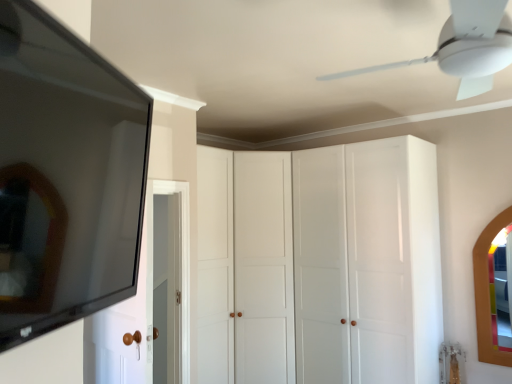
Question: Considering the relative sizes of white glossy cabinet at center and wooden-framed mirror at right, which appears as the second mirror when viewed from the top, in the image provided, is white glossy cabinet at center bigger than wooden-framed mirror at right, which appears as the second mirror when viewed from the top,?

Choices:
 (A) yes
 (B) no

Answer: (A)

Question: Could wooden-framed mirror at right, positioned as the 2th mirror in left-to-right order, be considered to be inside white glossy cabinet at center?

Choices:
 (A) yes
 (B) no

Answer: (B)

Question: Considering the relative sizes of white glossy cabinet at center and wooden-framed mirror at right, positioned as the 2th mirror in left-to-right order, in the image provided, is white glossy cabinet at center thinner than wooden-framed mirror at right, positioned as the 2th mirror in left-to-right order,?

Choices:
 (A) yes
 (B) no

Answer: (B)

Question: Can you confirm if white glossy cabinet at center is shorter than wooden-framed mirror at right, which is the first mirror in bottom-to-top order?

Choices:
 (A) no
 (B) yes

Answer: (A)

Question: From the image's perspective, is white glossy cabinet at center located beneath wooden-framed mirror at right, positioned as the 2th mirror in left-to-right order?

Choices:
 (A) no
 (B) yes

Answer: (B)

Question: Could you tell me if white glossy cabinet at center is facing wooden-framed mirror at right, positioned as the 2th mirror in left-to-right order?

Choices:
 (A) yes
 (B) no

Answer: (B)

Question: Considering the relative positions of matte black mirror at left, arranged as the second mirror when viewed from the back, and white wood door at left in the image provided, is matte black mirror at left, arranged as the second mirror when viewed from the back, in front of white wood door at left?

Choices:
 (A) no
 (B) yes

Answer: (B)

Question: Is matte black mirror at left, acting as the first mirror starting from the left, positioned with its back to white wood door at left?

Choices:
 (A) yes
 (B) no

Answer: (B)

Question: Is matte black mirror at left, acting as the first mirror starting from the left, facing towards white wood door at left?

Choices:
 (A) no
 (B) yes

Answer: (A)

Question: Is matte black mirror at left, which ranks as the first mirror in top-to-bottom order, beside white wood door at left?

Choices:
 (A) yes
 (B) no

Answer: (B)

Question: From the image's perspective, is matte black mirror at left, the 2th mirror positioned from the bottom, on top of white wood door at left?

Choices:
 (A) yes
 (B) no

Answer: (A)

Question: Does matte black mirror at left, the 2th mirror positioned from the bottom, appear on the left side of white wood door at left?

Choices:
 (A) yes
 (B) no

Answer: (B)

Question: Is white plastic ceiling fan at upper center positioned behind wooden-framed mirror at right, the 2th mirror viewed from the front?

Choices:
 (A) yes
 (B) no

Answer: (B)